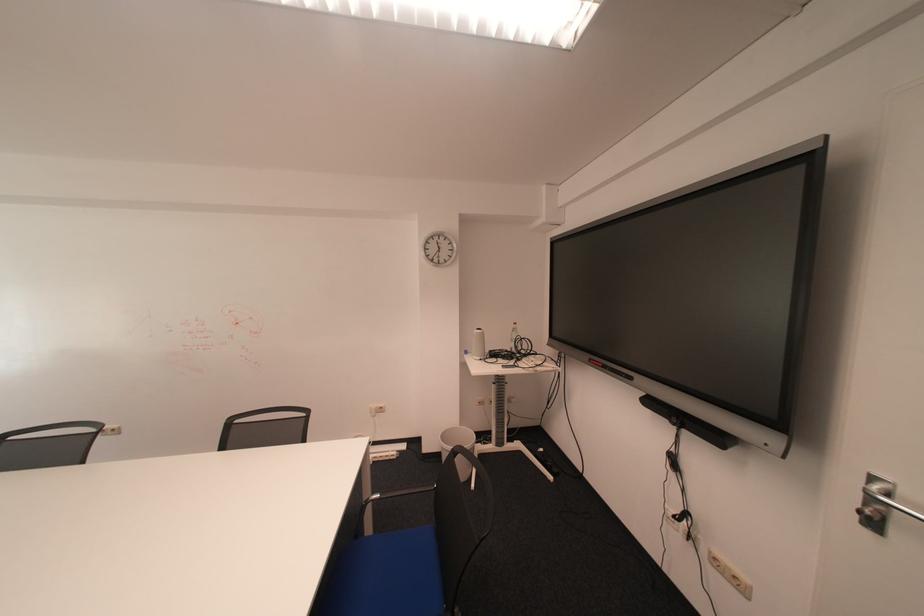
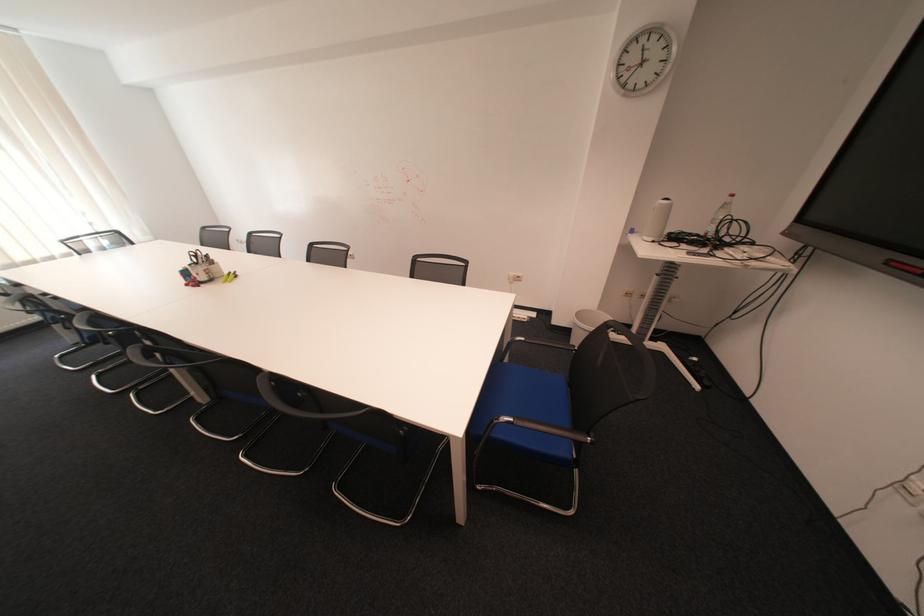
The point at (519, 346) is marked in the first image. Where is the corresponding point in the second image?

(714, 229)